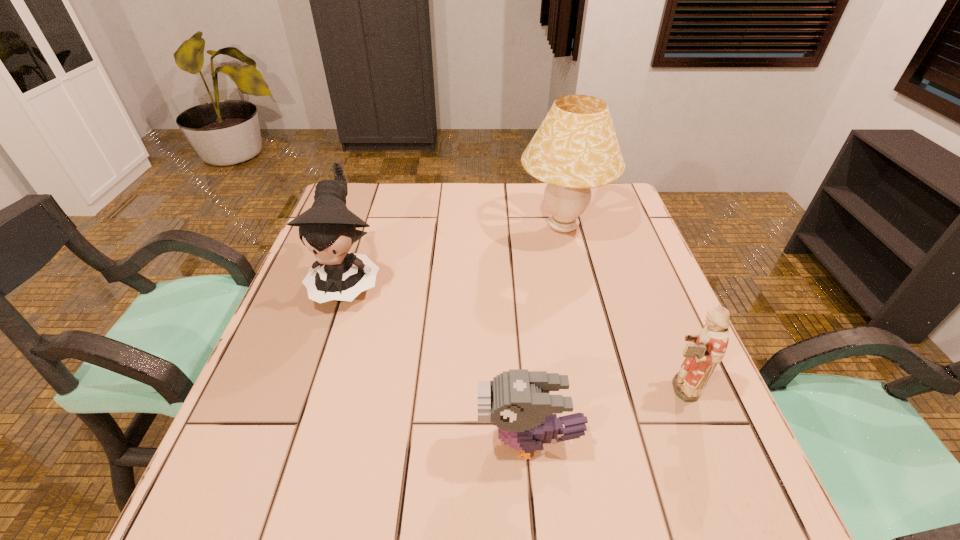
Where is `lampshade`? The height and width of the screenshot is (540, 960). lampshade is located at coordinates (575, 148).

Where is `doll`? Image resolution: width=960 pixels, height=540 pixels. doll is located at coordinates (328, 229).

Locate an element on the screen. the third shortest object is located at coordinates (328, 229).

Locate an element on the screen. This screenshot has height=540, width=960. the third farthest object is located at coordinates (710, 346).

Locate an element on the screen. Image resolution: width=960 pixels, height=540 pixels. the second shortest object is located at coordinates (710, 346).

Find the location of `the shortest object`. the shortest object is located at coordinates (518, 402).

At what (x,y) coordinates should I click in order to perform the action: click on the nearest object. Please return your answer as a coordinate pair (x, y). The height and width of the screenshot is (540, 960). Looking at the image, I should click on (518, 402).

Find the location of a particular element. This screenshot has height=540, width=960. free space located 0.080m on the left of the tallest object is located at coordinates (490, 227).

The image size is (960, 540). Find the location of `blank area located at the face of the leftmost object`. blank area located at the face of the leftmost object is located at coordinates (317, 373).

Find the location of `vacant space located 0.140m on the front-facing side of the second nearest object`. vacant space located 0.140m on the front-facing side of the second nearest object is located at coordinates (590, 388).